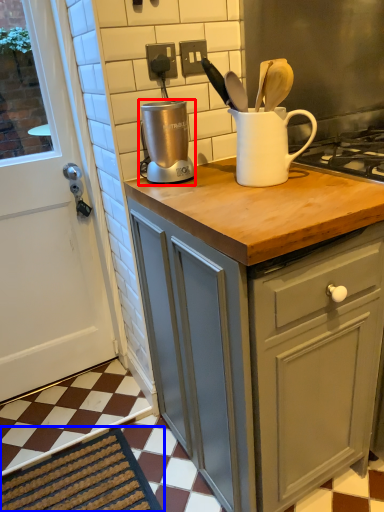
Question: Which object is further to the camera taking this photo, kitchen appliance (highlighted by a red box) or doormat (highlighted by a blue box)?

Choices:
 (A) kitchen appliance
 (B) doormat

Answer: (B)